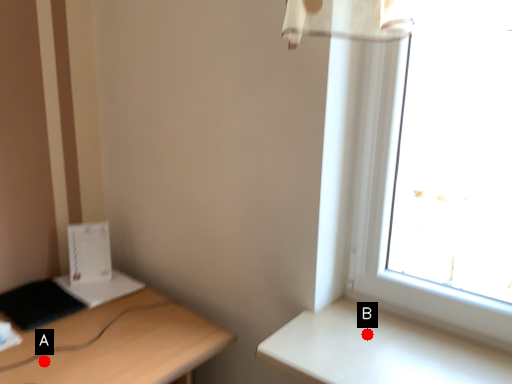
Question: Two points are circled on the image, labeled by A and B beside each circle. Among these points, which one is farthest from the camera?

Choices:
 (A) A is further
 (B) B is further

Answer: (A)